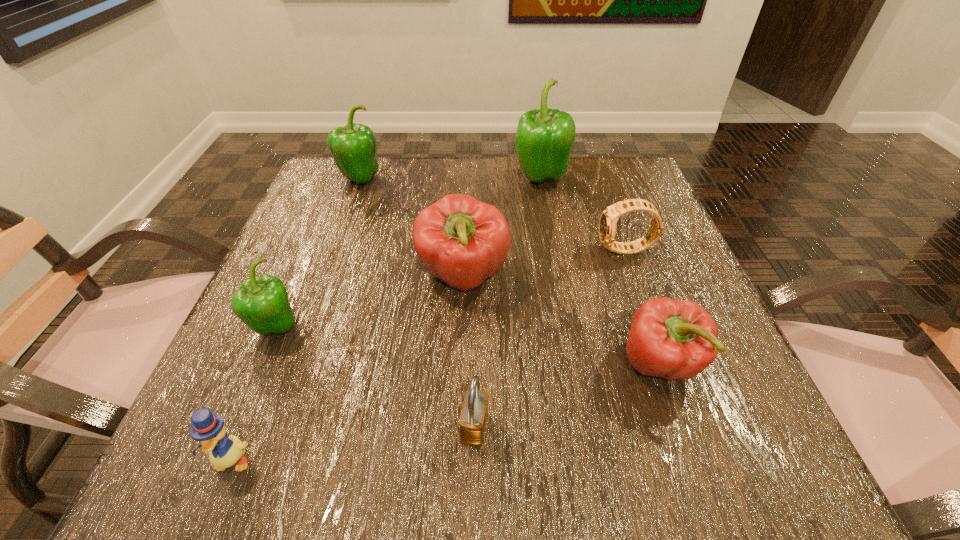
The width and height of the screenshot is (960, 540). Find the location of `the sixth object from left to right`. the sixth object from left to right is located at coordinates (544, 138).

Identify the location of the rightmost green bell pepper. Image resolution: width=960 pixels, height=540 pixels. (544, 138).

Locate an element on the screen. The width and height of the screenshot is (960, 540). the second smallest green bell pepper is located at coordinates (353, 147).

At what (x,y) coordinates should I click in order to perform the action: click on the bigger pink bell pepper. Please return your answer as a coordinate pair (x, y). This screenshot has width=960, height=540. Looking at the image, I should click on (462, 241).

Identify the location of the left pink bell pepper. This screenshot has height=540, width=960. (462, 241).

Find the location of a particular element. The width and height of the screenshot is (960, 540). the smallest green bell pepper is located at coordinates (261, 303).

I want to click on the rightmost bell pepper, so click(x=672, y=339).

You are a GUI agent. You are given a task and a screenshot of the screen. Output one action in this format:
    pyautogui.click(x=<x>, y=<y>)
    Task: Click on the nearer pink bell pepper
    This screenshot has height=540, width=960.
    Given the screenshot: What is the action you would take?
    pyautogui.click(x=672, y=339)

What are the coordinates of `black watch` in the screenshot? It's located at (608, 221).

Find the location of a particular element. This screenshot has width=960, height=540. padlock is located at coordinates (472, 423).